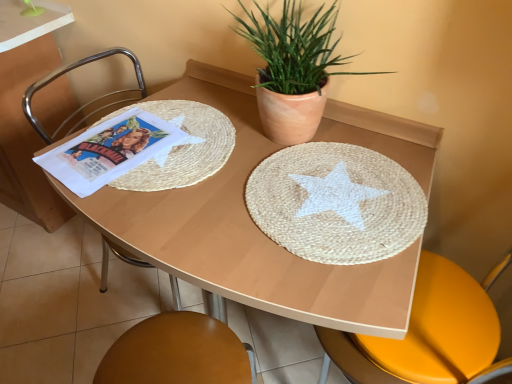
I want to click on unoccupied region to the right of terracotta clay pot at upper center, so click(387, 152).